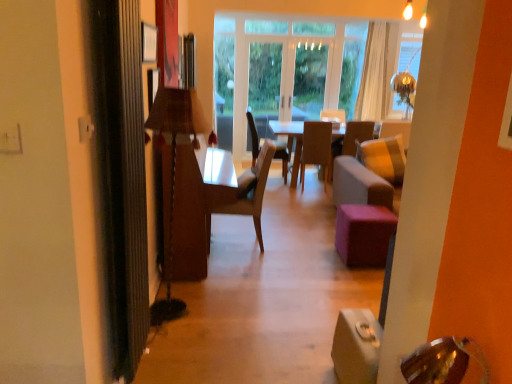
Where is `vacant space underneath light brown wood chair at center, the third chair viewed from the back (from a real-world perspective)`? vacant space underneath light brown wood chair at center, the third chair viewed from the back (from a real-world perspective) is located at coordinates (244, 238).